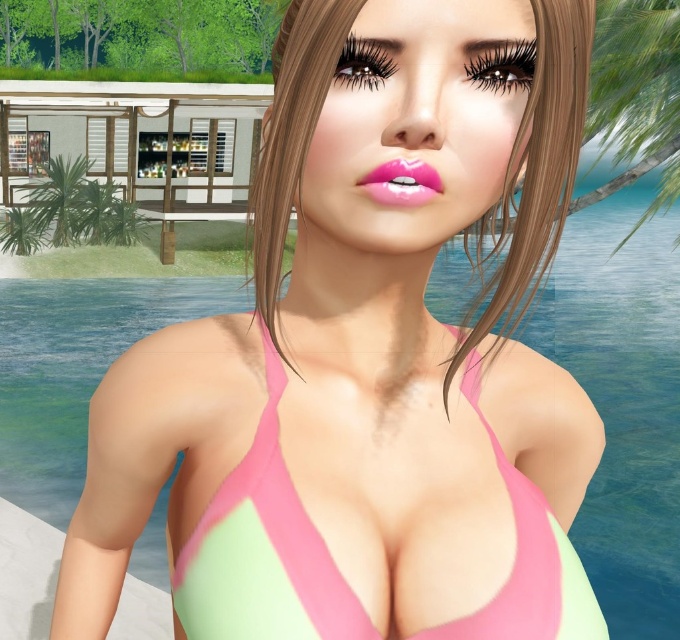
Question: Which point is closer to the camera?

Choices:
 (A) glossy pink lips at center
 (B) brownhair at center

Answer: (A)

Question: Which point is farther to the camera?

Choices:
 (A) glossy pink lips at center
 (B) pink matte bikini top at center

Answer: (B)

Question: Is brownhair at center in front of glossy pink lips at center?

Choices:
 (A) no
 (B) yes

Answer: (A)

Question: Which object appears closest to the camera in this image?

Choices:
 (A) pink matte bikini top at center
 (B) glossy pink lips at center

Answer: (B)

Question: In this image, where is pink matte bikini top at center located relative to glossy pink lips at center?

Choices:
 (A) below
 (B) above

Answer: (A)

Question: Can you confirm if brownhair at center is thinner than glossy pink lips at center?

Choices:
 (A) yes
 (B) no

Answer: (B)